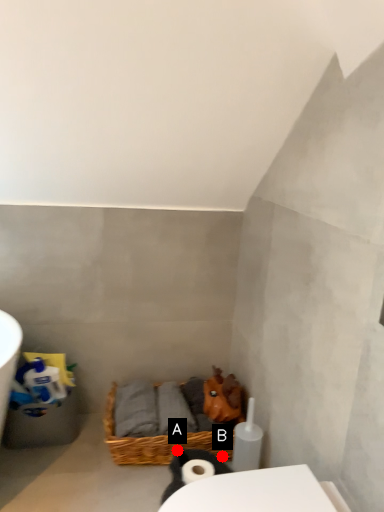
Question: Two points are circled on the image, labeled by A and B beside each circle. Which point appears farthest from the camera in this image?

Choices:
 (A) A is further
 (B) B is further

Answer: (B)